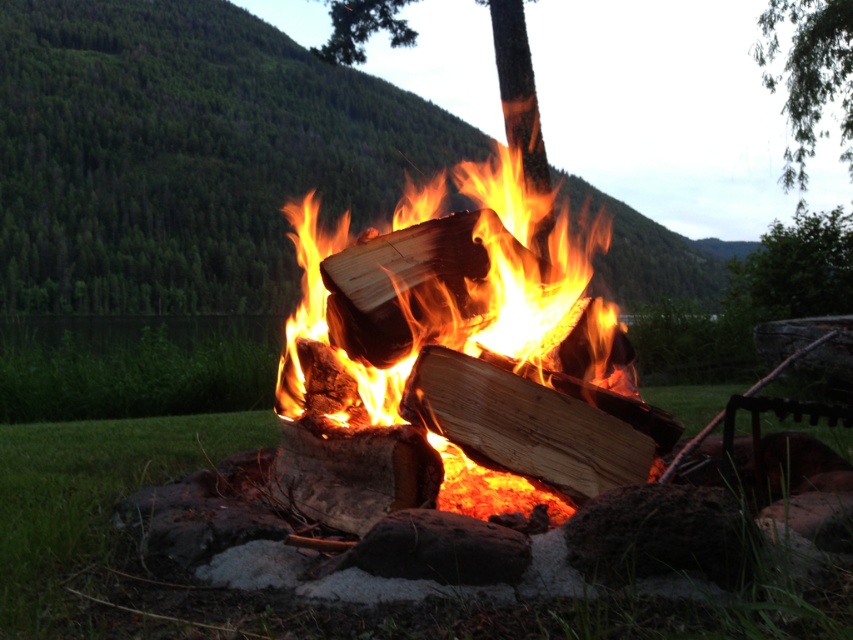
Between point (567, 273) and point (811, 48), which one is positioned in front?

Point (567, 273)

Who is more distant from viewer, (x=544, y=282) or (x=782, y=67)?

The point (x=782, y=67) is behind.

Measure the distance between charred wood fire at center and camera.

charred wood fire at center and camera are 9.99 feet apart.

Where is `charred wood fire at center`? The width and height of the screenshot is (853, 640). charred wood fire at center is located at coordinates (483, 340).

Looking at this image, between natural wood at center and green leafy tree at upper right, which one appears on the right side from the viewer's perspective?

green leafy tree at upper right

Measure the distance between point [563,484] and camera.

They are 3.09 meters apart.

Is point (628, 433) less distant than point (817, 52)?

Yes, point (628, 433) is in front of point (817, 52).

Locate an element on the screen. natural wood at center is located at coordinates (523, 424).

Find the location of a particular element. The width and height of the screenshot is (853, 640). charred wood fire at center is located at coordinates (483, 340).

Can you confirm if charred wood fire at center is thinner than natural wood at center?

No.

This screenshot has width=853, height=640. Identify the location of charred wood fire at center. (483, 340).

The height and width of the screenshot is (640, 853). Identify the location of charred wood fire at center. (483, 340).